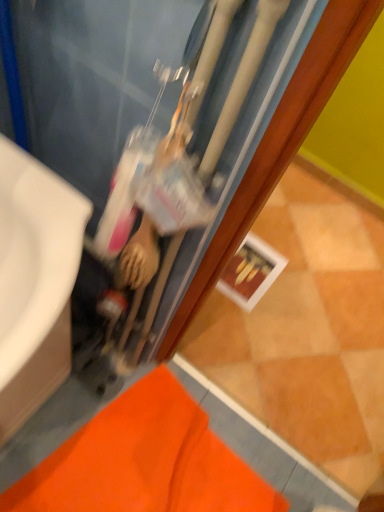
Question: Can you confirm if matte black water heater at center is taller than white glossy sink at left?

Choices:
 (A) yes
 (B) no

Answer: (A)

Question: Considering the relative positions of matte black water heater at center and white glossy sink at left in the image provided, is matte black water heater at center to the right of white glossy sink at left from the viewer's perspective?

Choices:
 (A) no
 (B) yes

Answer: (B)

Question: From a real-world perspective, is matte black water heater at center over white glossy sink at left?

Choices:
 (A) yes
 (B) no

Answer: (A)

Question: Is matte black water heater at center positioned behind white glossy sink at left?

Choices:
 (A) yes
 (B) no

Answer: (B)

Question: From the image's perspective, is matte black water heater at center on white glossy sink at left?

Choices:
 (A) yes
 (B) no

Answer: (A)

Question: Is white glossy sink at left completely or partially inside matte black water heater at center?

Choices:
 (A) yes
 (B) no

Answer: (B)

Question: Is white glossy sink at left not near matte black water heater at center?

Choices:
 (A) no
 (B) yes

Answer: (A)

Question: Does white glossy sink at left appear on the left side of matte black water heater at center?

Choices:
 (A) yes
 (B) no

Answer: (A)

Question: Does white glossy sink at left appear on the right side of matte black water heater at center?

Choices:
 (A) no
 (B) yes

Answer: (A)

Question: Is the position of white glossy sink at left less distant than that of matte black water heater at center?

Choices:
 (A) no
 (B) yes

Answer: (A)

Question: From a real-world perspective, is white glossy sink at left positioned under matte black water heater at center based on gravity?

Choices:
 (A) yes
 (B) no

Answer: (A)

Question: From a real-world perspective, is white glossy sink at left over matte black water heater at center?

Choices:
 (A) no
 (B) yes

Answer: (A)

Question: Does matte black water heater at center come behind orange fabric bath mat at lower left?

Choices:
 (A) no
 (B) yes

Answer: (A)